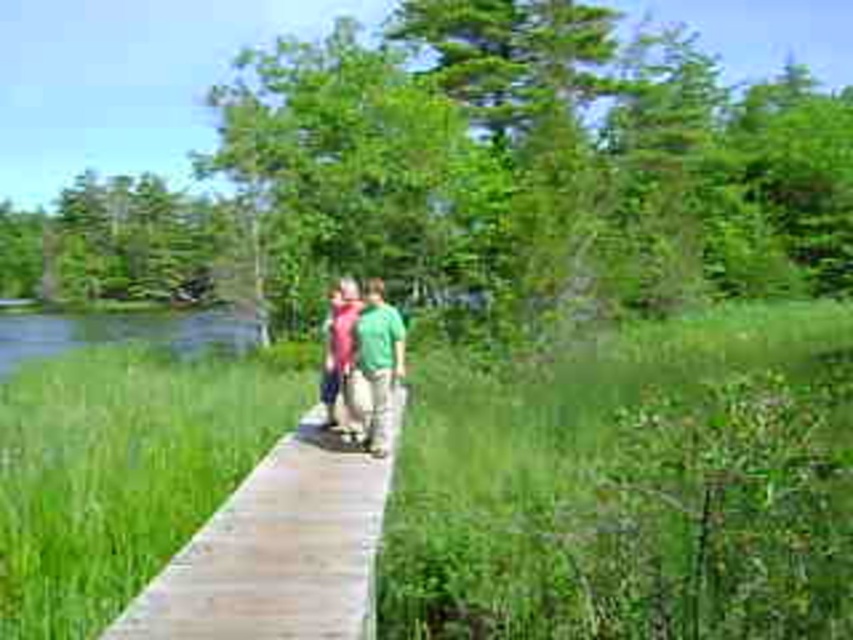
From the picture: You are standing at the start of the boardwalk and see the wooden plank at center and the matte pink sweater at center. Which object is closer to the right side of the boardwalk?

The wooden plank at center is to the right of the matte pink sweater at center, so the wooden plank at center is closer to the right side of the boardwalk.

You are a hiker who wants to place a small backpack on the wooden plank at center and the matte pink sweater at center. Which surface can better support the backpack without bending?

The matte pink sweater at center is thicker than the wooden plank at center, so it can better support the backpack without bending.

You are standing at the start of the boardwalk and see the wooden plank at center and the matte pink sweater at center. Which object is closer to you?

The wooden plank at center is closer to you because it is in front of the matte pink sweater at center.